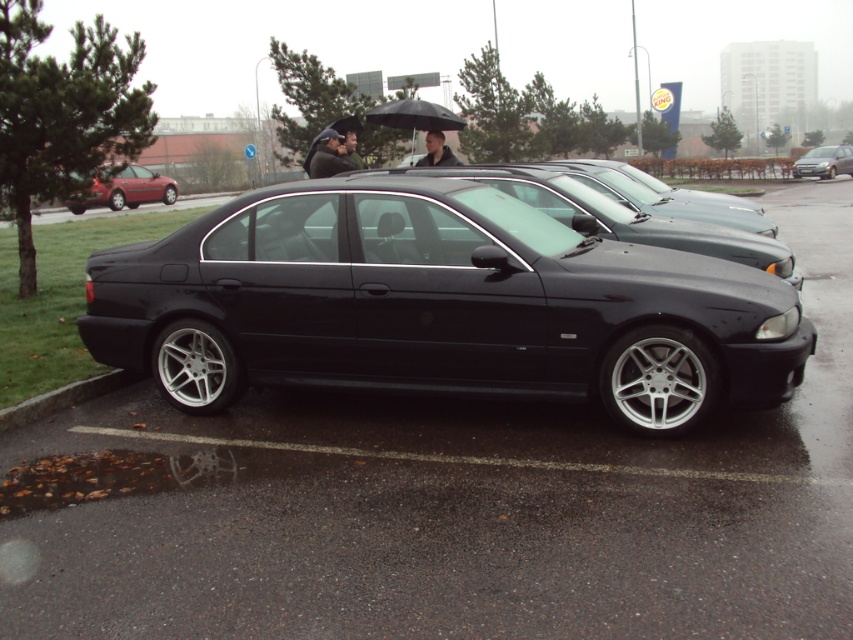
Question: Among these points, which one is farthest from the camera?

Choices:
 (A) (428, 120)
 (B) (608, 256)

Answer: (A)

Question: Is metallic red sedan at left in front of black matte umbrella at upper center?

Choices:
 (A) no
 (B) yes

Answer: (B)

Question: Among these objects, which one is nearest to the camera?

Choices:
 (A) black glossy sedan at center
 (B) dark gray fabric jacket at center

Answer: (A)

Question: Which object is positioned farthest from the smooth black hair at center?

Choices:
 (A) dark gray fabric jacket at center
 (B) black glossy sedan at center
 (C) matte black sedan at right

Answer: (C)

Question: Does shiny black sedan at center appear on the left side of black glossy sedan at center?

Choices:
 (A) no
 (B) yes

Answer: (B)

Question: Can you confirm if black matte umbrella at upper center is bigger than smooth black hair at center?

Choices:
 (A) no
 (B) yes

Answer: (B)